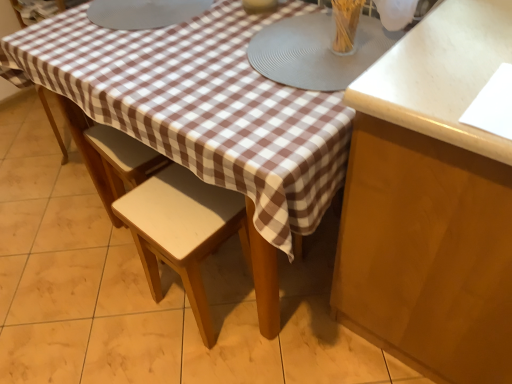
Question: Can you see matte gray placemat at center, the second round table from the left, touching light beige wood stool at center?

Choices:
 (A) yes
 (B) no

Answer: (B)

Question: From a real-world perspective, is matte gray placemat at center, which is the 1th round table from right to left, under light beige wood stool at center?

Choices:
 (A) no
 (B) yes

Answer: (A)

Question: Is matte gray placemat at center, which is the 1th round table from right to left, to the right of light beige wood stool at center from the viewer's perspective?

Choices:
 (A) yes
 (B) no

Answer: (A)

Question: Is matte gray placemat at center, which is the 1th round table from right to left, turned away from light beige wood stool at center?

Choices:
 (A) yes
 (B) no

Answer: (B)

Question: Does matte gray placemat at center, the second round table from the left, appear on the left side of light beige wood stool at center?

Choices:
 (A) no
 (B) yes

Answer: (A)

Question: Considering the relative sizes of matte gray placemat at center, the second round table from the left, and light beige wood stool at center in the image provided, is matte gray placemat at center, the second round table from the left, smaller than light beige wood stool at center?

Choices:
 (A) yes
 (B) no

Answer: (A)

Question: Considering the relative sizes of light beige wood stool at center and clear glass vase at upper center in the image provided, is light beige wood stool at center shorter than clear glass vase at upper center?

Choices:
 (A) no
 (B) yes

Answer: (A)

Question: Is light beige wood stool at center taller than clear glass vase at upper center?

Choices:
 (A) yes
 (B) no

Answer: (A)

Question: From the image's perspective, is light beige wood stool at center on clear glass vase at upper center?

Choices:
 (A) no
 (B) yes

Answer: (A)

Question: Is light beige wood stool at center in contact with clear glass vase at upper center?

Choices:
 (A) no
 (B) yes

Answer: (A)

Question: From a real-world perspective, is light beige wood stool at center positioned over clear glass vase at upper center based on gravity?

Choices:
 (A) yes
 (B) no

Answer: (B)

Question: Is there a large distance between light beige wood stool at center and clear glass vase at upper center?

Choices:
 (A) no
 (B) yes

Answer: (A)

Question: Would you say clear glass vase at upper center is outside matte gray placemat at center, which is the 1th round table from right to left?

Choices:
 (A) yes
 (B) no

Answer: (A)